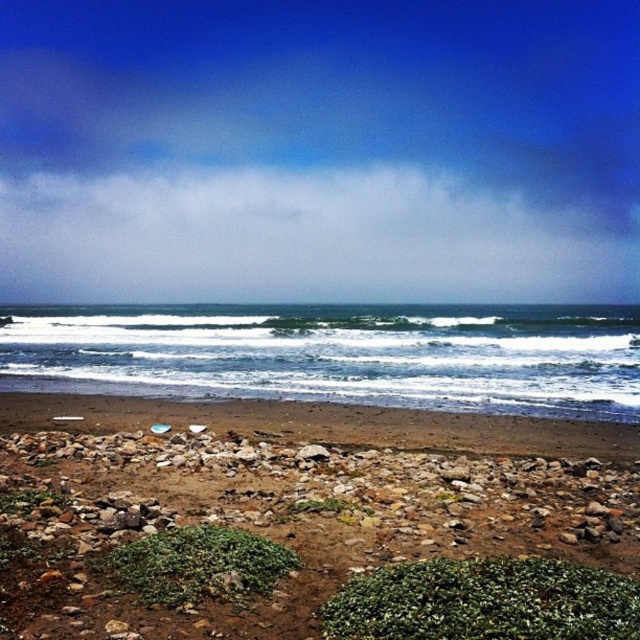
Question: Does brown rocky beach at lower center appear on the left side of blue ocean water at center?

Choices:
 (A) yes
 (B) no

Answer: (A)

Question: Does brown rocky beach at lower center have a smaller size compared to blue ocean water at center?

Choices:
 (A) no
 (B) yes

Answer: (B)

Question: Is brown rocky beach at lower center thinner than blue ocean water at center?

Choices:
 (A) yes
 (B) no

Answer: (A)

Question: Which of the following is the closest to the observer?

Choices:
 (A) brown rocky beach at lower center
 (B) blue ocean water at center

Answer: (A)